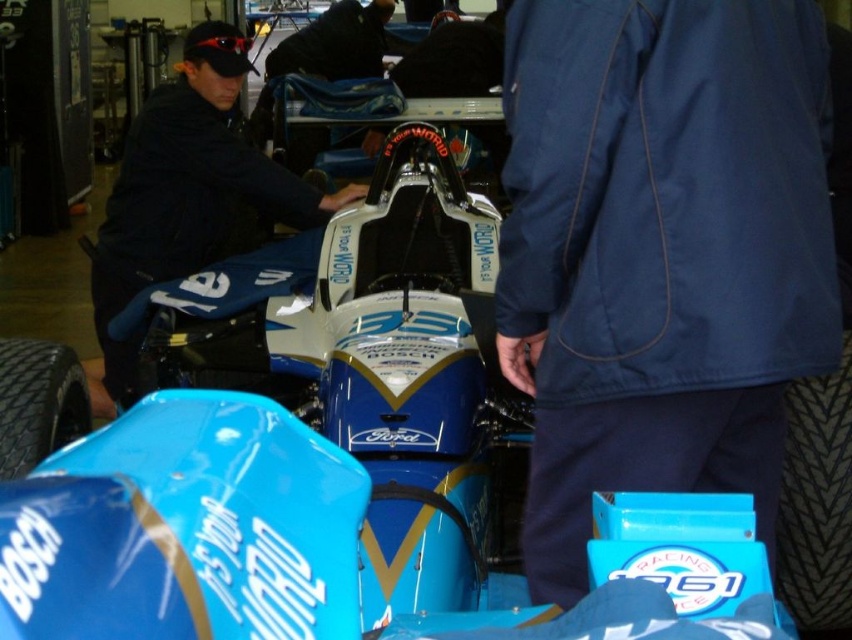
Measure the distance between navy blue jacket at center and black rubber tire at lower left.

The distance of navy blue jacket at center from black rubber tire at lower left is 5.41 feet.

Who is shorter, navy blue jacket at center or black rubber tire at lower left?

black rubber tire at lower left

Find the location of `navy blue jacket at center`. navy blue jacket at center is located at coordinates (660, 252).

Measure the distance from dark blue jacket at center to black rubber tire at lower left.

They are 99.82 centimeters apart.

Locate an element on the screen. The height and width of the screenshot is (640, 852). dark blue jacket at center is located at coordinates (188, 193).

Identify the location of dark blue jacket at center. (188, 193).

Is navy blue jacket at center closer to the viewer compared to dark blue jacket at center?

Yes, navy blue jacket at center is closer to the viewer.

Is navy blue jacket at center shorter than dark blue jacket at center?

Yes, navy blue jacket at center is shorter than dark blue jacket at center.

Where is `navy blue jacket at center`? The image size is (852, 640). navy blue jacket at center is located at coordinates (660, 252).

Where is `navy blue jacket at center`? navy blue jacket at center is located at coordinates (660, 252).